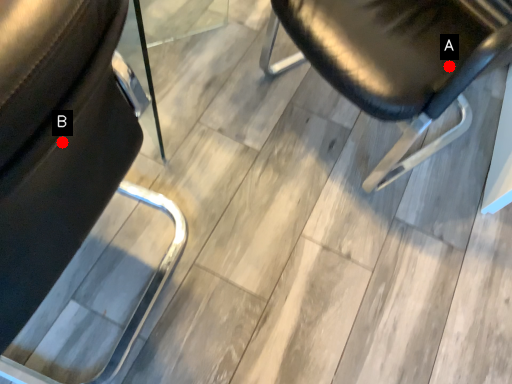
Question: Two points are circled on the image, labeled by A and B beside each circle. Which of the following is the closest to the observer?

Choices:
 (A) A is closer
 (B) B is closer

Answer: (B)